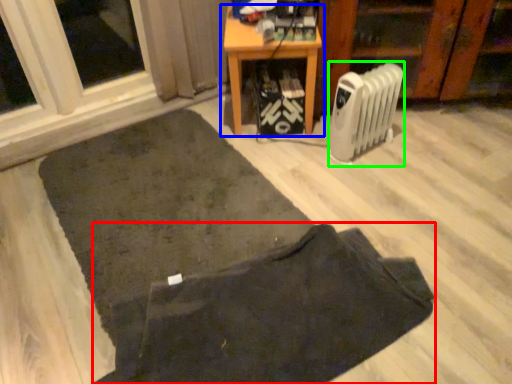
Question: Considering the real-world distances, which object is closest to doormat (highlighted by a red box)? table (highlighted by a blue box) or radiator (highlighted by a green box).

Choices:
 (A) table
 (B) radiator

Answer: (B)